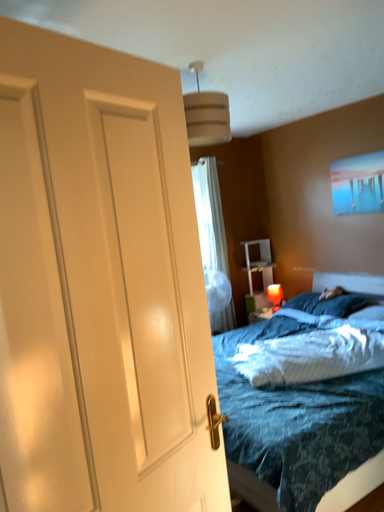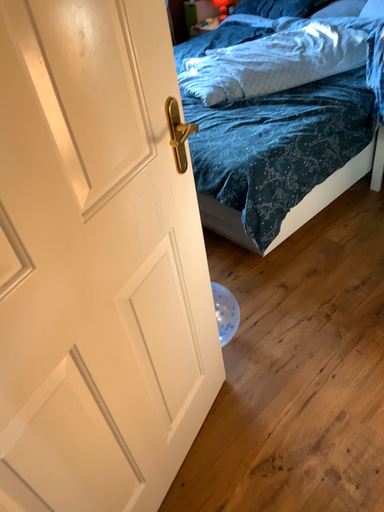
Question: Which way did the camera rotate in the video?

Choices:
 (A) rotated right
 (B) rotated left

Answer: (A)